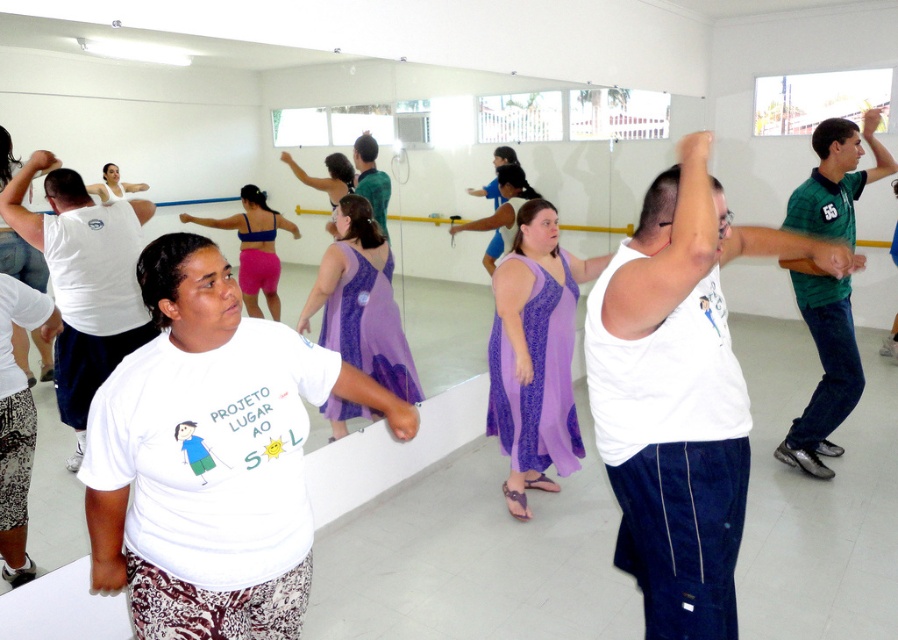
You are a photographer setting up for a photoshoot in the studio. You need to focus on the white tank top at center and the white fabric at upper center. Which of these two items is larger in size?

The white tank top at center is bigger than the white fabric at upper center.